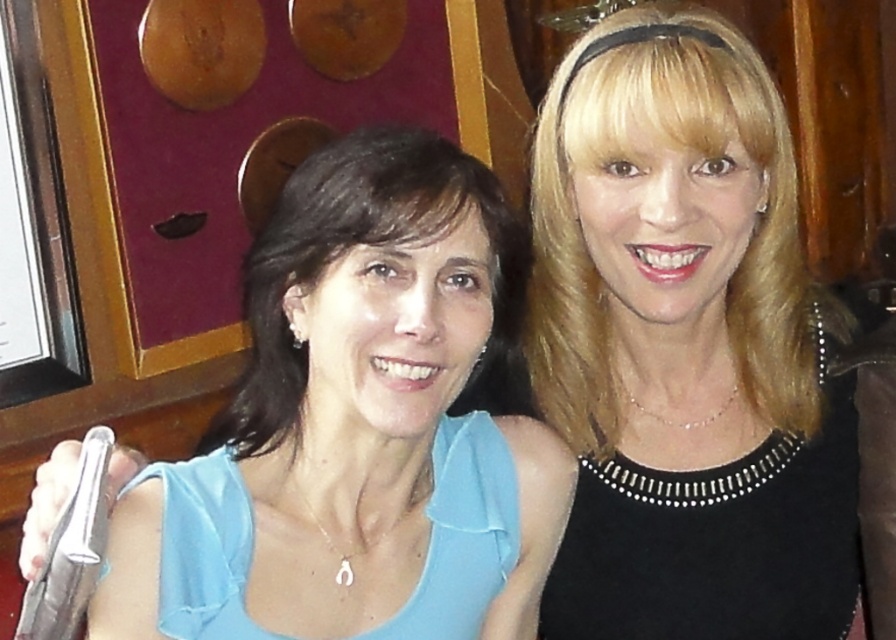
Between black satin dress at upper right and matte blue blouse at center, which one has more height?

black satin dress at upper right

The image size is (896, 640). What do you see at coordinates (686, 346) in the screenshot? I see `black satin dress at upper right` at bounding box center [686, 346].

What do you see at coordinates (686, 346) in the screenshot?
I see `black satin dress at upper right` at bounding box center [686, 346].

Image resolution: width=896 pixels, height=640 pixels. In order to click on black satin dress at upper right in this screenshot , I will do `click(686, 346)`.